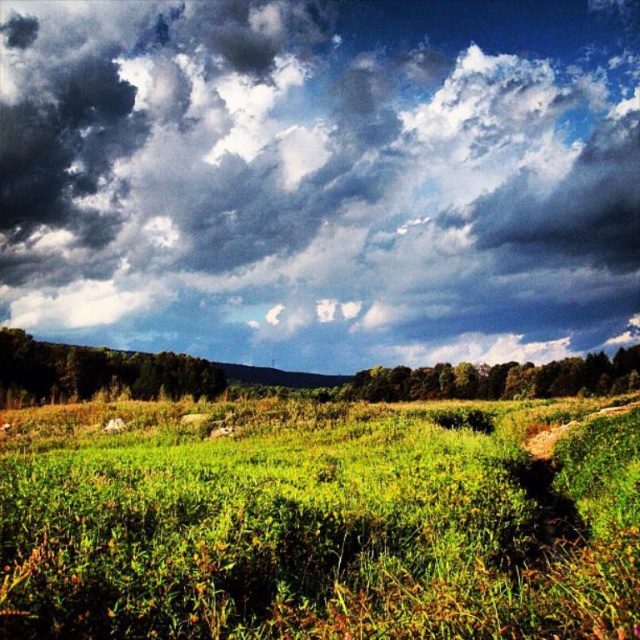
Does dark fluffy cloud at upper center appear under green grassy field at center?

No, dark fluffy cloud at upper center is not below green grassy field at center.

Who is taller, dark fluffy cloud at upper center or green grassy field at center?

With more height is dark fluffy cloud at upper center.

Does point (440, 145) lie in front of point (317, 483)?

No, (440, 145) is further to viewer.

This screenshot has width=640, height=640. Identify the location of dark fluffy cloud at upper center. (321, 177).